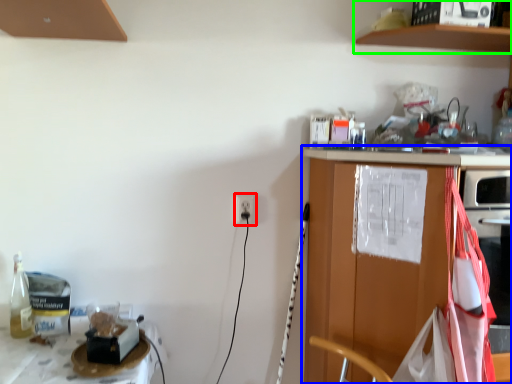
Question: Which object is the farthest from electric outlet (highlighted by a red box)? Choose among these: countertop (highlighted by a blue box) or shelf (highlighted by a green box).

Choices:
 (A) countertop
 (B) shelf

Answer: (B)